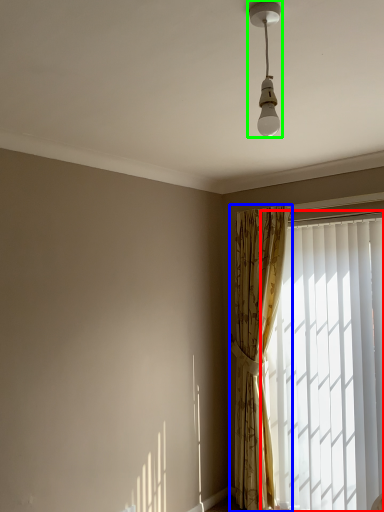
Question: Which is nearer to the window (highlighted by a red box)? curtain (highlighted by a blue box) or lamp (highlighted by a green box).

Choices:
 (A) curtain
 (B) lamp

Answer: (A)